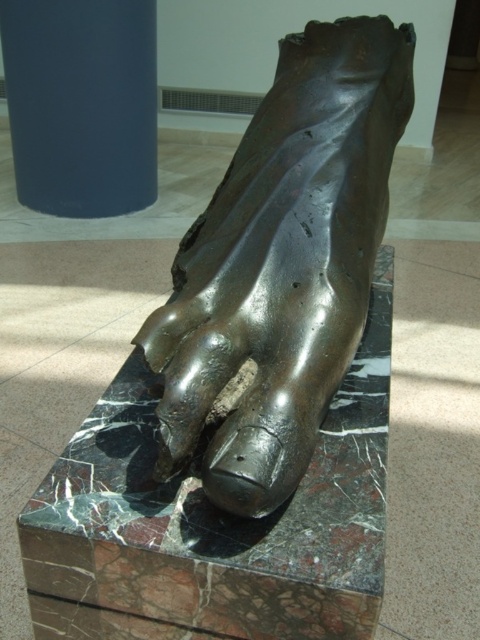
Question: Among these objects, which one is farthest from the camera?

Choices:
 (A) shiny bronze foot at center
 (B) blue matte cylinder at upper left

Answer: (B)

Question: Does shiny bronze foot at center come behind blue matte cylinder at upper left?

Choices:
 (A) yes
 (B) no

Answer: (B)

Question: In this image, where is shiny bronze foot at center located relative to blue matte cylinder at upper left?

Choices:
 (A) above
 (B) below

Answer: (B)

Question: Which point appears closest to the camera in this image?

Choices:
 (A) (58, 77)
 (B) (309, 275)

Answer: (B)

Question: Where is shiny bronze foot at center located in relation to blue matte cylinder at upper left in the image?

Choices:
 (A) below
 (B) above

Answer: (A)

Question: Which of the following is the closest to the observer?

Choices:
 (A) shiny bronze foot at center
 (B) blue matte cylinder at upper left

Answer: (A)